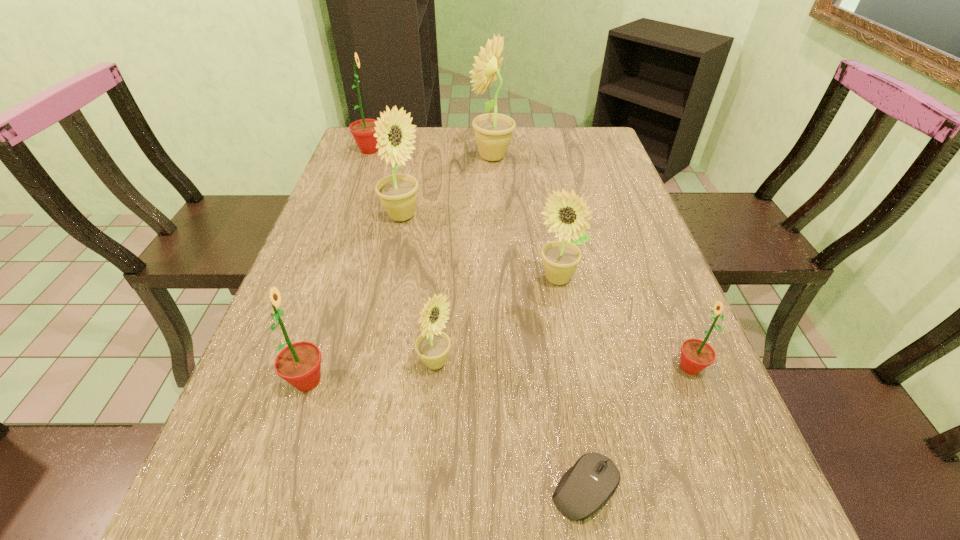
This screenshot has height=540, width=960. What are the coordinates of `free space between the third farthest sunflower and the rightmost green sunflower` in the screenshot? It's located at (546, 292).

What are the coordinates of `free space between the shortest object and the second biggest green sunflower` in the screenshot? It's located at (446, 435).

Locate which object is the sixth closest to the black computer equipment. Please provide its 2D coordinates. Your answer should be formatted as a tuple, i.e. [(x, y)], where the tuple contains the x and y coordinates of a point satisfying the conditions above.

[(493, 132)]

Image resolution: width=960 pixels, height=540 pixels. I want to click on the third closest object to the third nearest yellow sunflower, so click(x=567, y=215).

Where is `sunflower that is the closest to the farthest yellow sunflower`? Image resolution: width=960 pixels, height=540 pixels. sunflower that is the closest to the farthest yellow sunflower is located at coordinates (398, 192).

Select which sunflower appears as the closest to the biggest green sunflower. Please provide its 2D coordinates. Your answer should be formatted as a tuple, i.e. [(x, y)], where the tuple contains the x and y coordinates of a point satisfying the conditions above.

[(398, 192)]

Where is `yellow sunflower object that ranks as the fourth closest to the black computer equipment`? The image size is (960, 540). yellow sunflower object that ranks as the fourth closest to the black computer equipment is located at coordinates (493, 132).

What are the coordinates of `the closest yellow sunflower relative to the black computer equipment` in the screenshot? It's located at (432, 346).

Identify which green sunflower is located as the nearest to the second biggest yellow sunflower. Please provide its 2D coordinates. Your answer should be formatted as a tuple, i.e. [(x, y)], where the tuple contains the x and y coordinates of a point satisfying the conditions above.

[(363, 131)]

Locate which green sunflower ranks in proximity to the fourth farthest object. Please provide its 2D coordinates. Your answer should be formatted as a tuple, i.e. [(x, y)], where the tuple contains the x and y coordinates of a point satisfying the conditions above.

[(696, 355)]